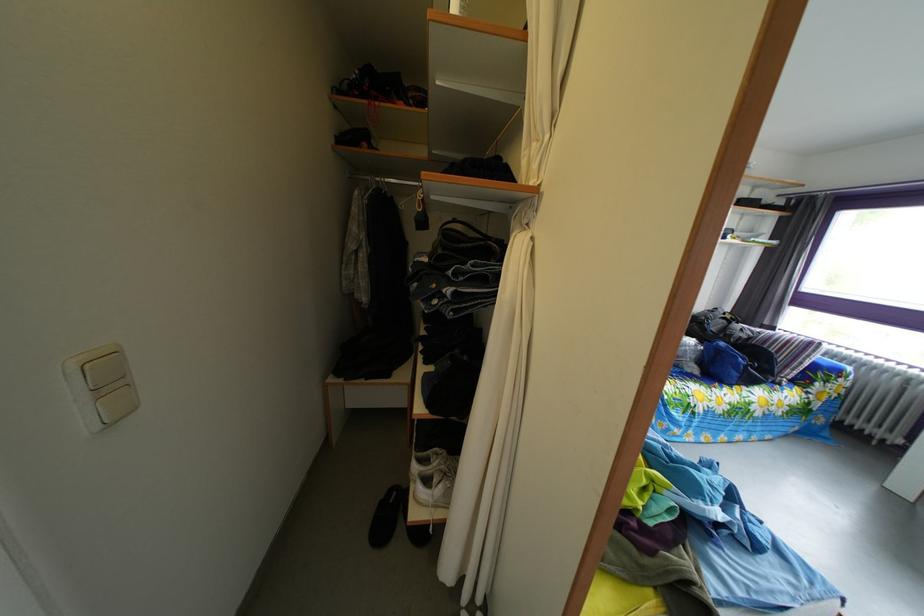
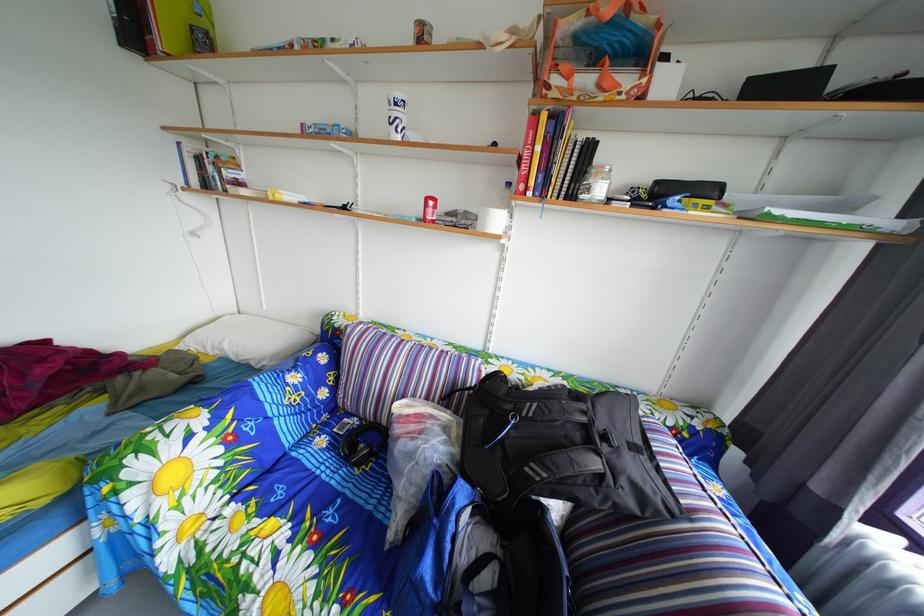
In a continuous first-person perspective shot, in which direction is the camera moving?

The cameraman walked toward right, forward.